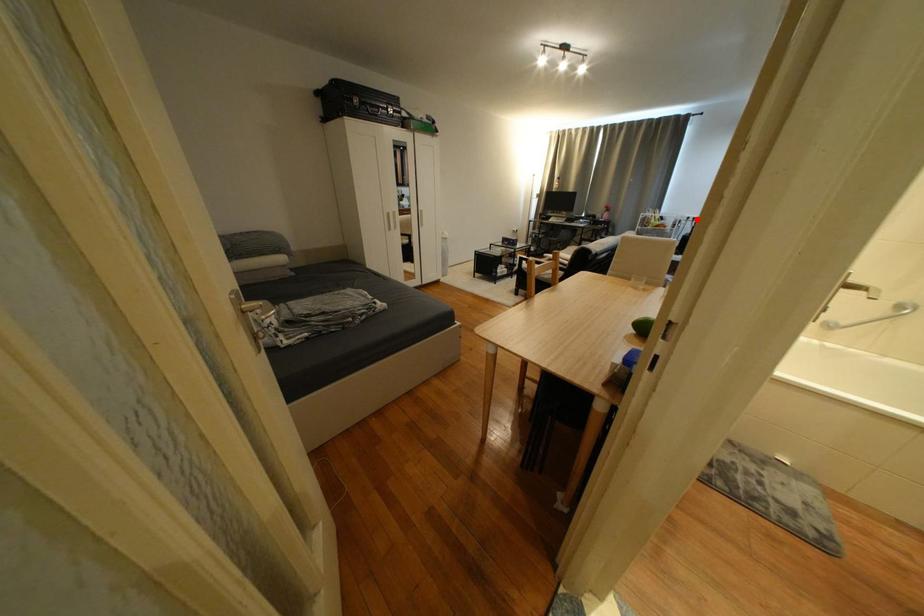
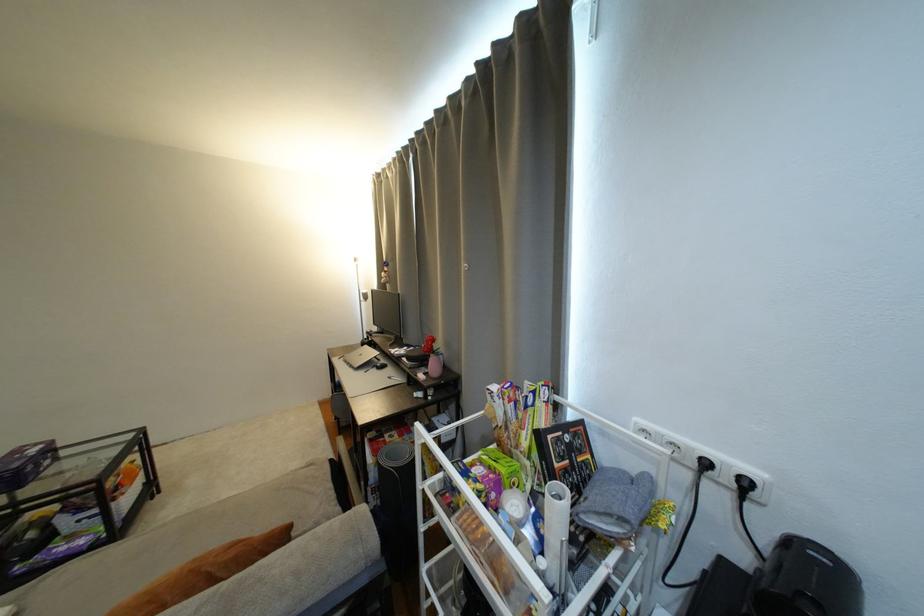
Question: I am providing you with two images of the same scene from different viewpoints. Given a red point in image1, look at the same physical point in image2. Is it:

Choices:
 (A) Closer to the viewpoint
 (B) Farther from the viewpoint

Answer: (B)